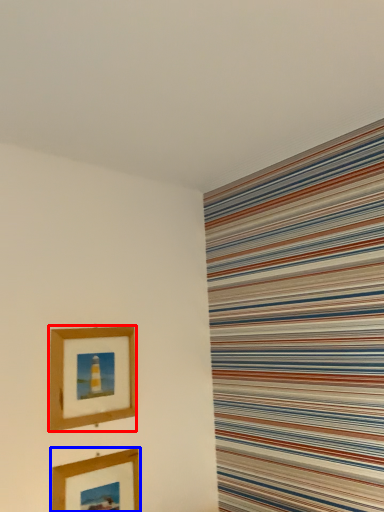
Question: Which of the following is the closest to the observer, picture frame (highlighted by a red box) or picture frame (highlighted by a blue box)?

Choices:
 (A) picture frame
 (B) picture frame

Answer: (B)